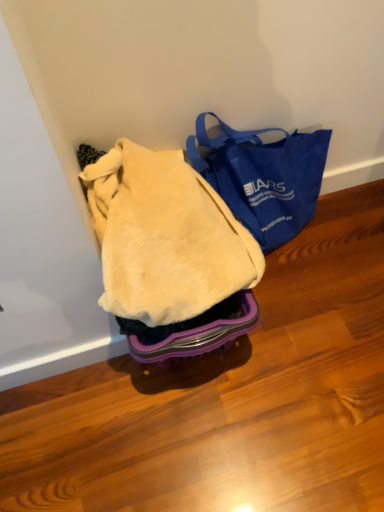
Question: Should I look upward or downward to see beige fuzzy blanket at center?

Choices:
 (A) down
 (B) up

Answer: (B)